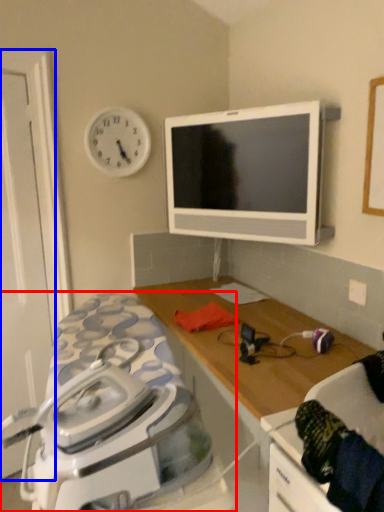
Question: Which object is further to the camera taking this photo, home appliance (highlighted by a red box) or door (highlighted by a blue box)?

Choices:
 (A) home appliance
 (B) door

Answer: (B)